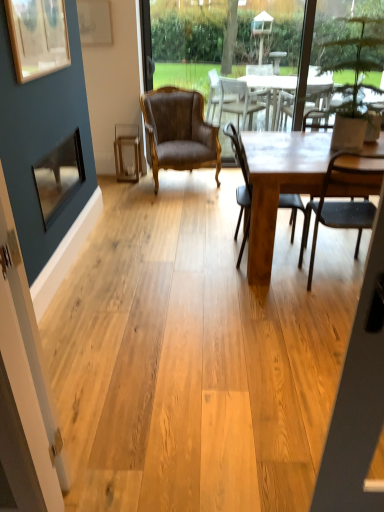
Identify the location of free spot below brown leather armchair at center, which is the third chair in front-to-back order (from a real-world perspective). This screenshot has width=384, height=512. (184, 181).